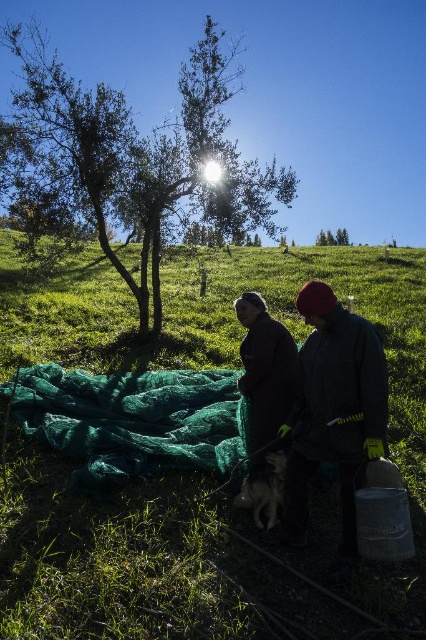
Question: Which is farther from the green netting at center?

Choices:
 (A) dark green fabric at center
 (B) green netting at upper center

Answer: (B)

Question: Which of the following is the closest to the observer?

Choices:
 (A) (370, 378)
 (B) (276, 413)

Answer: (A)

Question: Which point is closer to the camera?

Choices:
 (A) green leafy tree at upper center
 (B) dark green fabric at center

Answer: (B)

Question: Can you confirm if white fur dog at center is positioned above green netting at upper center?

Choices:
 (A) no
 (B) yes

Answer: (A)

Question: Can you confirm if dark brown leather jacket at center is wider than green netting at upper center?

Choices:
 (A) no
 (B) yes

Answer: (A)

Question: Can you confirm if green leafy tree at upper center is positioned to the right of dark brown leather jacket at center?

Choices:
 (A) yes
 (B) no

Answer: (B)